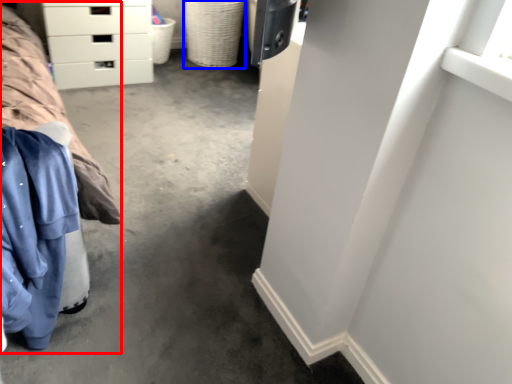
Question: Which of the following is the farthest to the observer, bed (highlighted by a red box) or basket (highlighted by a blue box)?

Choices:
 (A) bed
 (B) basket

Answer: (B)